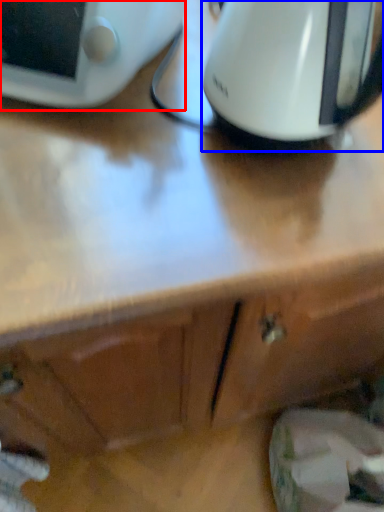
Question: Which point is further to the camera, home appliance (highlighted by a red box) or kitchen appliance (highlighted by a blue box)?

Choices:
 (A) home appliance
 (B) kitchen appliance

Answer: (A)